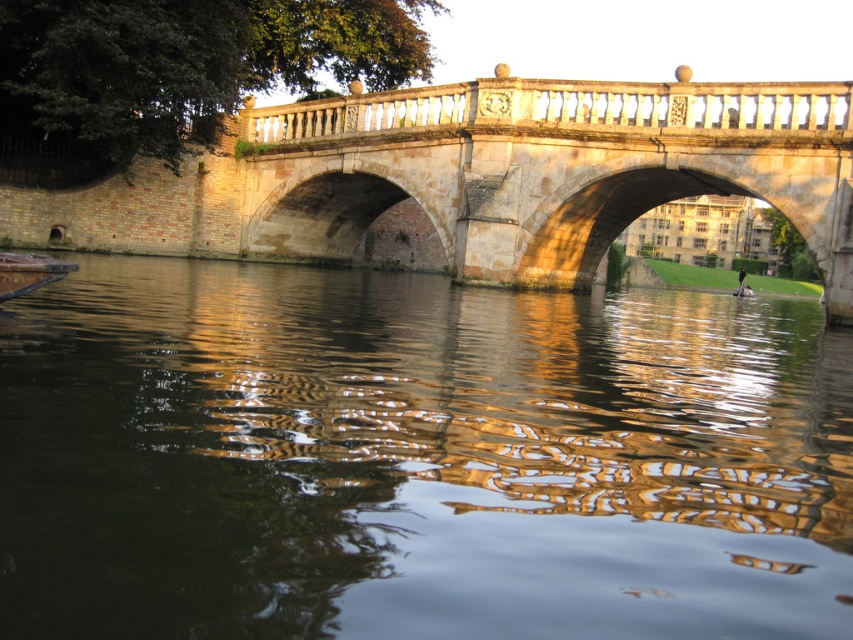
You are a tourist standing on the stone bridge at center. You want to take a photo of the dark brown water at center. Where should you point your camera?

You should point your camera downward toward the dark brown water at center since it is located below the stone bridge at center where you are standing.

You are standing on the bank of the canal and see the dark brown water at center and the stone bridge at center. Which object is nearer to you?

The dark brown water at center is closer to the viewer than the stone bridge at center.